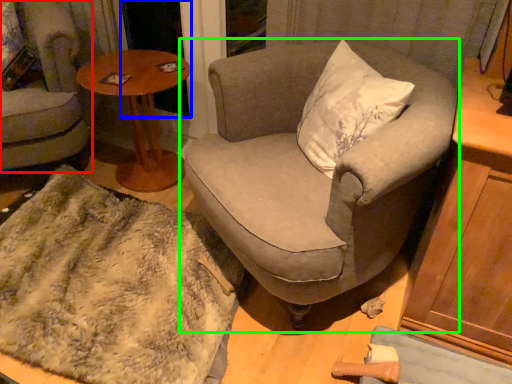
Question: Based on their relative distances, which object is farther from chair (highlighted by a red box)? Choose from screen door (highlighted by a blue box) and chair (highlighted by a green box).

Choices:
 (A) screen door
 (B) chair

Answer: (B)